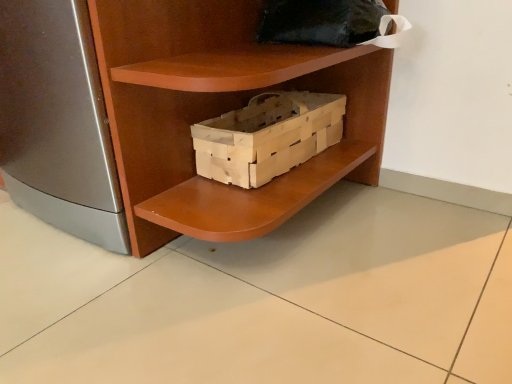
Question: From the image's perspective, would you say wooden crate at center is shown under wooden crate at center?

Choices:
 (A) no
 (B) yes

Answer: (B)

Question: Is wooden crate at center with wooden crate at center?

Choices:
 (A) yes
 (B) no

Answer: (B)

Question: Can you confirm if wooden crate at center is bigger than wooden crate at center?

Choices:
 (A) no
 (B) yes

Answer: (A)

Question: Can wooden crate at center be found inside wooden crate at center?

Choices:
 (A) no
 (B) yes

Answer: (A)

Question: Does wooden crate at center have a greater width compared to wooden crate at center?

Choices:
 (A) no
 (B) yes

Answer: (A)

Question: Considering the relative positions of wooden crate at center and wooden crate at center in the image provided, is wooden crate at center behind wooden crate at center?

Choices:
 (A) no
 (B) yes

Answer: (B)

Question: Is wooden crate at center to the left of wooden crate at center from the viewer's perspective?

Choices:
 (A) no
 (B) yes

Answer: (B)

Question: From a real-world perspective, is wooden crate at center located beneath wooden crate at center?

Choices:
 (A) yes
 (B) no

Answer: (B)

Question: Is wooden crate at center oriented away from wooden crate at center?

Choices:
 (A) yes
 (B) no

Answer: (B)

Question: Can you confirm if wooden crate at center is taller than wooden crate at center?

Choices:
 (A) yes
 (B) no

Answer: (A)

Question: From the image's perspective, is wooden crate at center on top of wooden crate at center?

Choices:
 (A) no
 (B) yes

Answer: (B)

Question: Does wooden crate at center come in front of wooden crate at center?

Choices:
 (A) yes
 (B) no

Answer: (A)

Question: Is wooden crate at center taller than black fabric pillow at upper center?

Choices:
 (A) yes
 (B) no

Answer: (A)